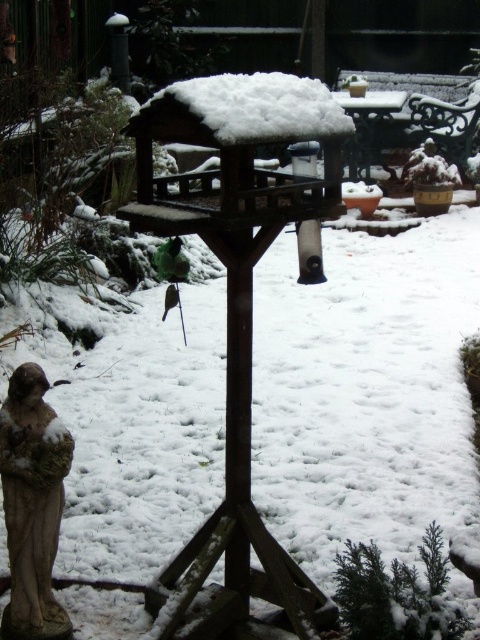
Question: Which point is farther to the camera?

Choices:
 (A) green matte bird at center-left
 (B) white fluffy snow at center
 (C) stone statue at lower left

Answer: (A)

Question: Which of these objects is positioned farthest from the stone statue at lower left?

Choices:
 (A) green matte bird at center-left
 (B) white fluffy snow at center

Answer: (A)

Question: Among these points, which one is farthest from the camera?

Choices:
 (A) (296, 99)
 (B) (35, 516)

Answer: (B)

Question: Does white fluffy snow at center come in front of green matte bird at center-left?

Choices:
 (A) yes
 (B) no

Answer: (A)

Question: Observing the image, what is the correct spatial positioning of stone statue at lower left in reference to green matte bird at center-left?

Choices:
 (A) above
 (B) below

Answer: (B)

Question: Is stone statue at lower left behind white fluffy snow at center?

Choices:
 (A) yes
 (B) no

Answer: (A)